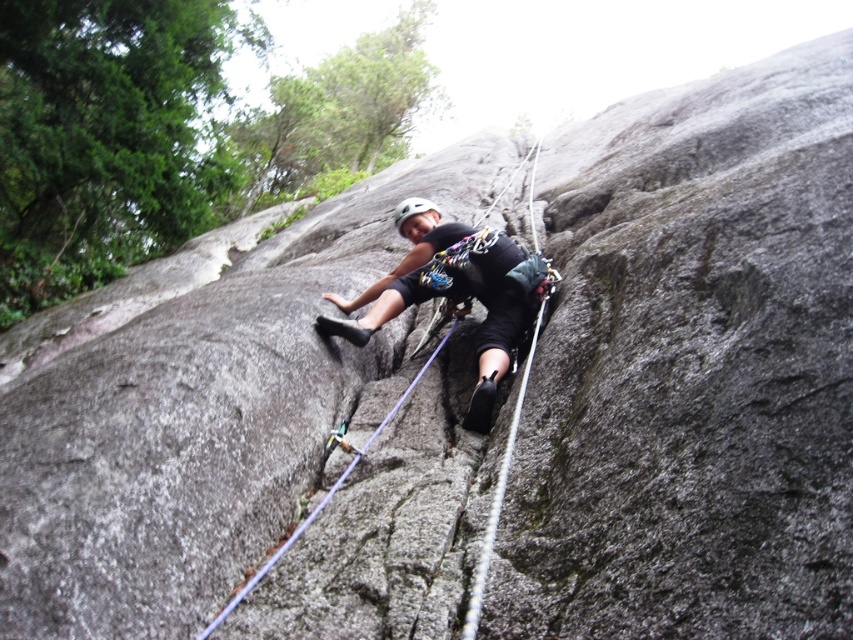
Question: Can you confirm if matte black helmet at center is positioned to the left of white matte helmet at center?

Choices:
 (A) yes
 (B) no

Answer: (B)

Question: Does matte black helmet at center appear on the left side of white matte helmet at center?

Choices:
 (A) no
 (B) yes

Answer: (A)

Question: Which of the following is the farthest from the observer?

Choices:
 (A) (422, 211)
 (B) (465, 225)

Answer: (B)

Question: Can you confirm if matte black helmet at center is positioned below white matte helmet at center?

Choices:
 (A) yes
 (B) no

Answer: (A)

Question: Among these objects, which one is farthest from the camera?

Choices:
 (A) matte black helmet at center
 (B) white matte helmet at center

Answer: (B)